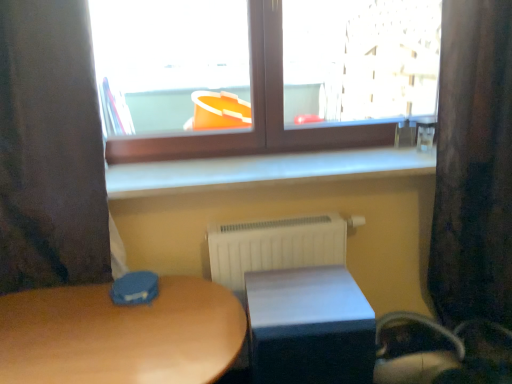
Identify the location of free area below brown wooden window at upper center (from a real-world perspective). This screenshot has width=512, height=384. (234, 162).